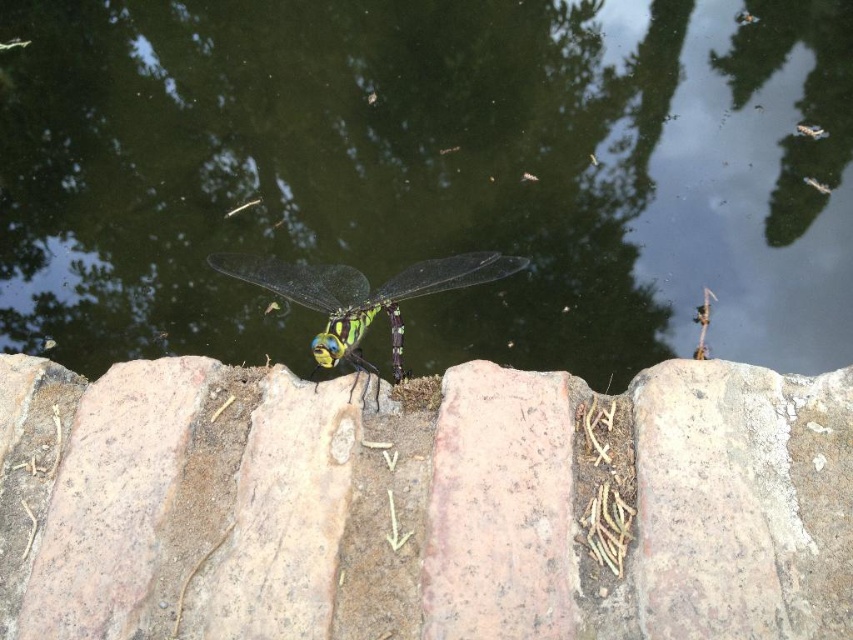
You are an artist trying to paint the scene. You notice the smooth stone at center and the transparent glass dragonfly at center. Which object should you paint first to ensure proper layering?

The smooth stone at center should be painted first because it is in front of the transparent glass dragonfly at center, so painting it first allows the dragonfly to be layered over it correctly.

You are standing in front of the dragonfly on the tiles. You notice two points marked on the tiles. Which point is closer to you, point [436,211] or point [837,531]?

Point [436,211] is closer to you because it is further to the viewer than point [837,531].